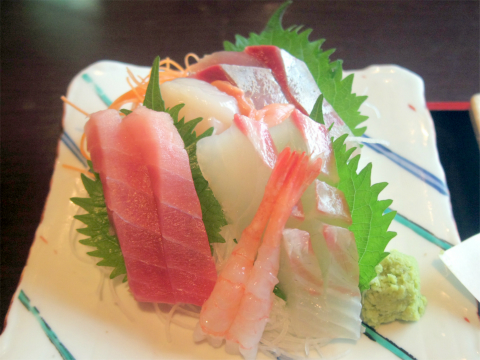
What are the coordinates of `table` in the screenshot? It's located at (459, 148), (31, 161).